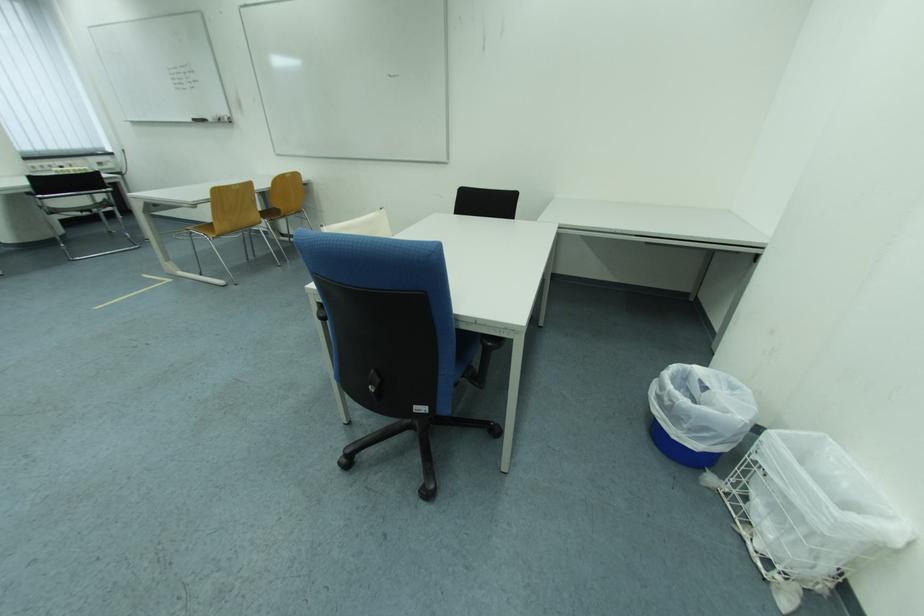
What do you see at coordinates (482, 360) in the screenshot?
I see `the blue chair sitting surface` at bounding box center [482, 360].